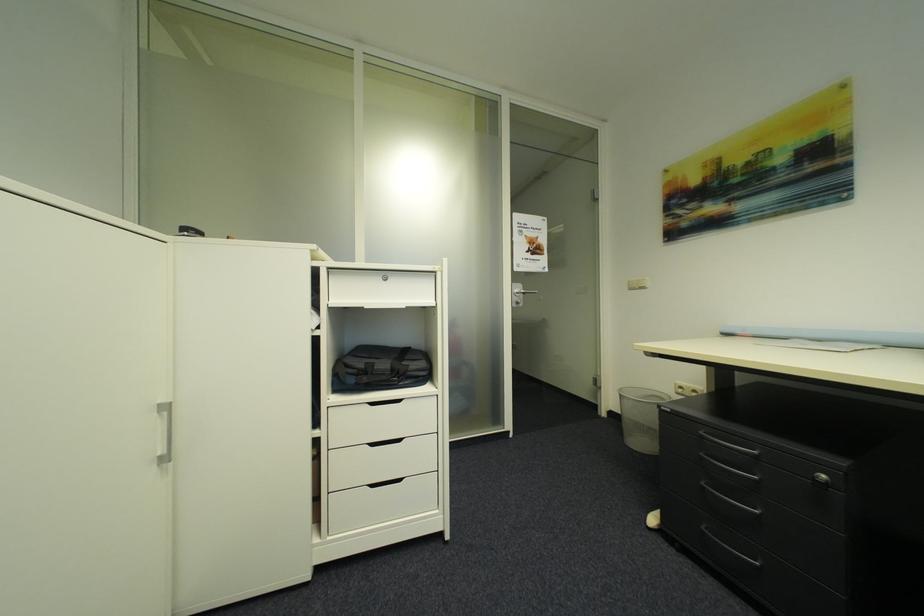
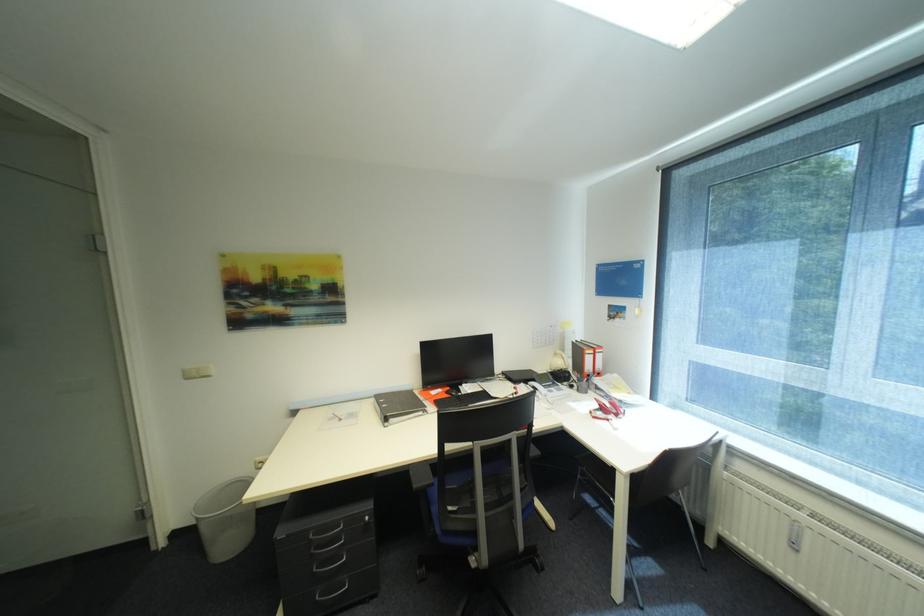
Question: The first image is from the beginning of the video and the second image is from the end. How did the camera likely rotate when shooting the video?

Choices:
 (A) Left
 (B) Right
 (C) Up
 (D) Down

Answer: (B)